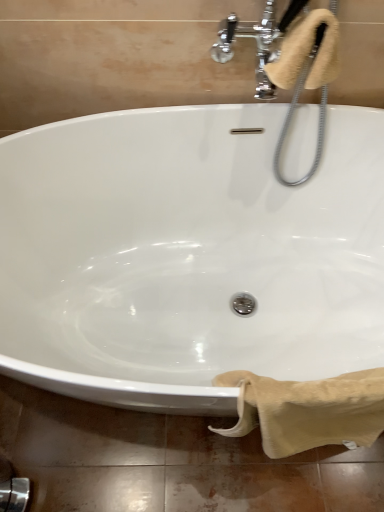
This screenshot has width=384, height=512. Describe the element at coordinates (307, 410) in the screenshot. I see `beige cotton towel at lower right, which is the second bath towel in top-to-bottom order` at that location.

How much space does beige cotton towel at lower right, arranged as the 1th bath towel when ordered from the bottom, occupy horizontally?

beige cotton towel at lower right, arranged as the 1th bath towel when ordered from the bottom, is 5.49 inches wide.

Find the location of a particular element. This screenshot has width=384, height=512. beige cotton towel at lower right, arranged as the 1th bath towel when ordered from the bottom is located at coordinates (307, 410).

At what (x,y) coordinates should I click in order to perform the action: click on beige soft towel at upper right, the second bath towel positioned from the bottom. Please return your answer as a coordinate pair (x, y). The image size is (384, 512). Looking at the image, I should click on (307, 52).

The width and height of the screenshot is (384, 512). Describe the element at coordinates (307, 52) in the screenshot. I see `beige soft towel at upper right, the second bath towel positioned from the bottom` at that location.

In order to face beige soft towel at upper right, the second bath towel positioned from the bottom, should I rotate leftwards or rightwards?

Rotate right and turn 14.872 degrees.

Find the location of a particular element. The width and height of the screenshot is (384, 512). beige cotton towel at lower right, arranged as the 1th bath towel when ordered from the bottom is located at coordinates (307, 410).

Based on their positions, is beige soft towel at upper right, the second bath towel positioned from the bottom, located to the left or right of beige cotton towel at lower right, arranged as the 1th bath towel when ordered from the bottom?

beige soft towel at upper right, the second bath towel positioned from the bottom, is to the left of beige cotton towel at lower right, arranged as the 1th bath towel when ordered from the bottom.

Is beige soft towel at upper right, the second bath towel positioned from the bottom, in front of or behind beige cotton towel at lower right, which is the second bath towel in top-to-bottom order, in the image?

beige soft towel at upper right, the second bath towel positioned from the bottom, is behind beige cotton towel at lower right, which is the second bath towel in top-to-bottom order.

Considering the points (291, 54) and (225, 432), which point is behind, point (291, 54) or point (225, 432)?

The point (225, 432) is farther.

From the image's perspective, between beige soft towel at upper right, which is the first bath towel from top to bottom, and beige cotton towel at lower right, arranged as the 1th bath towel when ordered from the bottom, which one is located above?

beige soft towel at upper right, which is the first bath towel from top to bottom, appears higher in the image.

From a real-world perspective, who is located higher, beige soft towel at upper right, which is the first bath towel from top to bottom, or beige cotton towel at lower right, arranged as the 1th bath towel when ordered from the bottom?

beige soft towel at upper right, which is the first bath towel from top to bottom, from a real-world perspective.

In the scene shown: Considering the relative sizes of beige soft towel at upper right, the second bath towel positioned from the bottom, and beige cotton towel at lower right, arranged as the 1th bath towel when ordered from the bottom, in the image provided, is beige soft towel at upper right, the second bath towel positioned from the bottom, wider than beige cotton towel at lower right, arranged as the 1th bath towel when ordered from the bottom,?

Yes.

Can you confirm if beige soft towel at upper right, the second bath towel positioned from the bottom, is taller than beige cotton towel at lower right, which is the second bath towel in top-to-bottom order?

Incorrect, the height of beige soft towel at upper right, the second bath towel positioned from the bottom, is not larger of that of beige cotton towel at lower right, which is the second bath towel in top-to-bottom order.

Between beige soft towel at upper right, which is the first bath towel from top to bottom, and beige cotton towel at lower right, arranged as the 1th bath towel when ordered from the bottom, which one has smaller size?

Smaller between the two is beige soft towel at upper right, which is the first bath towel from top to bottom.

Is beige soft towel at upper right, which is the first bath towel from top to bottom, surrounding beige cotton towel at lower right, arranged as the 1th bath towel when ordered from the bottom?

Actually, beige cotton towel at lower right, arranged as the 1th bath towel when ordered from the bottom, is outside beige soft towel at upper right, which is the first bath towel from top to bottom.

Is beige soft towel at upper right, which is the first bath towel from top to bottom, not near beige cotton towel at lower right, arranged as the 1th bath towel when ordered from the bottom?

No, beige soft towel at upper right, which is the first bath towel from top to bottom, is not far away from beige cotton towel at lower right, arranged as the 1th bath towel when ordered from the bottom.

Is beige soft towel at upper right, which is the first bath towel from top to bottom, turned away from beige cotton towel at lower right, arranged as the 1th bath towel when ordered from the bottom?

No, beige soft towel at upper right, which is the first bath towel from top to bottom, is not facing away from beige cotton towel at lower right, arranged as the 1th bath towel when ordered from the bottom.

The image size is (384, 512). What are the coordinates of `bath towel on the right side of beige soft towel at upper right, which is the first bath towel from top to bottom` in the screenshot? It's located at (307, 410).

Based on their positions, is beige cotton towel at lower right, arranged as the 1th bath towel when ordered from the bottom, located to the left or right of beige soft towel at upper right, the second bath towel positioned from the bottom?

Clearly, beige cotton towel at lower right, arranged as the 1th bath towel when ordered from the bottom, is on the right of beige soft towel at upper right, the second bath towel positioned from the bottom, in the image.

Which object is closer to the camera, beige cotton towel at lower right, arranged as the 1th bath towel when ordered from the bottom, or beige soft towel at upper right, the second bath towel positioned from the bottom?

beige cotton towel at lower right, arranged as the 1th bath towel when ordered from the bottom, is more forward.

Is point (230, 383) positioned in front of point (333, 70)?

Yes, point (230, 383) is in front of point (333, 70).

From the image's perspective, relative to beige soft towel at upper right, which is the first bath towel from top to bottom, is beige cotton towel at lower right, which is the second bath towel in top-to-bottom order, above or below?

Clearly, from the image's perspective, beige cotton towel at lower right, which is the second bath towel in top-to-bottom order, is below beige soft towel at upper right, which is the first bath towel from top to bottom.

From a real-world perspective, which object rests below the other?

From a 3D spatial view, beige cotton towel at lower right, arranged as the 1th bath towel when ordered from the bottom, is below.

Does beige cotton towel at lower right, arranged as the 1th bath towel when ordered from the bottom, have a greater width compared to beige soft towel at upper right, the second bath towel positioned from the bottom?

In fact, beige cotton towel at lower right, arranged as the 1th bath towel when ordered from the bottom, might be narrower than beige soft towel at upper right, the second bath towel positioned from the bottom.

From their relative heights in the image, would you say beige cotton towel at lower right, which is the second bath towel in top-to-bottom order, is taller or shorter than beige soft towel at upper right, the second bath towel positioned from the bottom?

beige cotton towel at lower right, which is the second bath towel in top-to-bottom order, is taller than beige soft towel at upper right, the second bath towel positioned from the bottom.

From the picture: Considering the sizes of objects beige cotton towel at lower right, which is the second bath towel in top-to-bottom order, and beige soft towel at upper right, the second bath towel positioned from the bottom, in the image provided, who is bigger, beige cotton towel at lower right, which is the second bath towel in top-to-bottom order, or beige soft towel at upper right, the second bath towel positioned from the bottom,?

beige cotton towel at lower right, which is the second bath towel in top-to-bottom order, is bigger.

Is beige cotton towel at lower right, which is the second bath towel in top-to-bottom order, surrounding beige soft towel at upper right, which is the first bath towel from top to bottom?

No, beige cotton towel at lower right, which is the second bath towel in top-to-bottom order, does not contain beige soft towel at upper right, which is the first bath towel from top to bottom.

Are beige cotton towel at lower right, which is the second bath towel in top-to-bottom order, and beige soft towel at upper right, which is the first bath towel from top to bottom, far apart?

Actually, beige cotton towel at lower right, which is the second bath towel in top-to-bottom order, and beige soft towel at upper right, which is the first bath towel from top to bottom, are a little close together.

Does beige cotton towel at lower right, which is the second bath towel in top-to-bottom order, turn towards beige soft towel at upper right, which is the first bath towel from top to bottom?

No, beige cotton towel at lower right, which is the second bath towel in top-to-bottom order, does not turn towards beige soft towel at upper right, which is the first bath towel from top to bottom.

How far apart are beige cotton towel at lower right, which is the second bath towel in top-to-bottom order, and beige soft towel at upper right, which is the first bath towel from top to bottom?

A distance of 28.06 inches exists between beige cotton towel at lower right, which is the second bath towel in top-to-bottom order, and beige soft towel at upper right, which is the first bath towel from top to bottom.

This screenshot has height=512, width=384. In order to click on bath towel that is above the beige cotton towel at lower right, which is the second bath towel in top-to-bottom order (from the image's perspective) in this screenshot , I will do `click(307, 52)`.

At what (x,y) coordinates should I click in order to perform the action: click on bath towel behind the beige cotton towel at lower right, which is the second bath towel in top-to-bottom order. Please return your answer as a coordinate pair (x, y). This screenshot has width=384, height=512. Looking at the image, I should click on (307, 52).

Find the location of `bath towel that appears below the beige soft towel at upper right, the second bath towel positioned from the bottom (from a real-world perspective)`. bath towel that appears below the beige soft towel at upper right, the second bath towel positioned from the bottom (from a real-world perspective) is located at coordinates (307, 410).